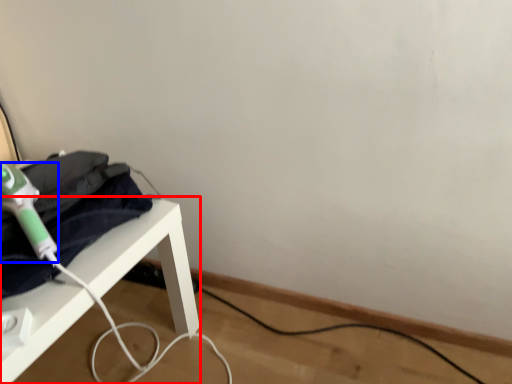
Question: Among these objects, which one is farthest to the camera, furniture (highlighted by a red box) or hair drier (highlighted by a blue box)?

Choices:
 (A) furniture
 (B) hair drier

Answer: (B)